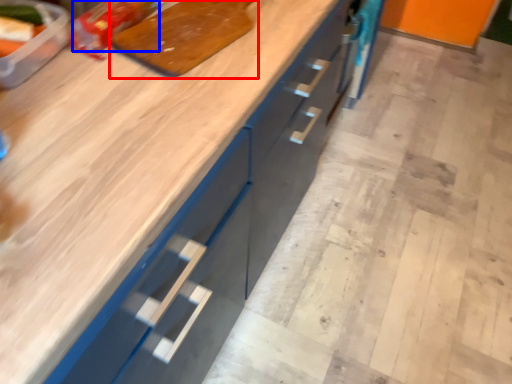
Question: Among these objects, which one is farthest to the camera, cutting board (highlighted by a red box) or food (highlighted by a blue box)?

Choices:
 (A) cutting board
 (B) food

Answer: (B)